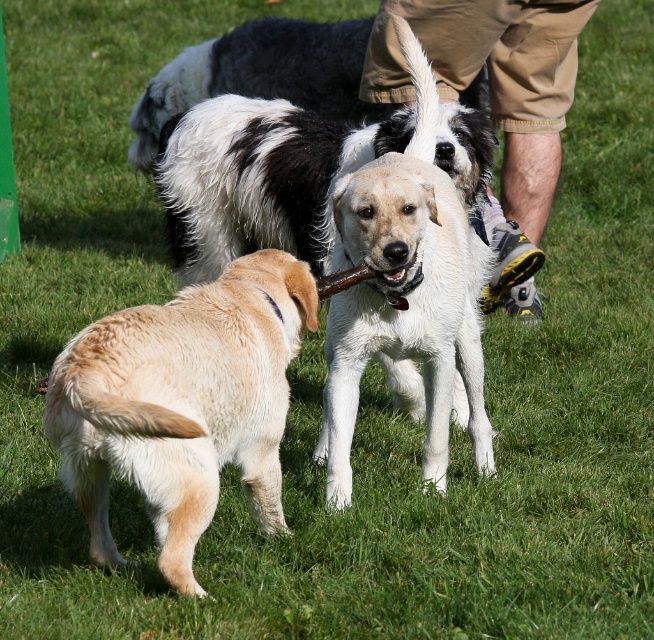
You are standing in the field and want to call the golden fur dog at center and the white matte dog at center. Which dog will you see first when looking towards them?

The golden fur dog at center is closer to the viewer than the white matte dog at center, so you will see the golden fur dog at center first when looking towards them.

You are a photographer standing at the edge of the grassy field. You want to take a photo of the white matte dog at center and the khaki shorts at center. How far apart are these two items from each other?

The white matte dog at center is 3.56 feet away from the khaki shorts at center.